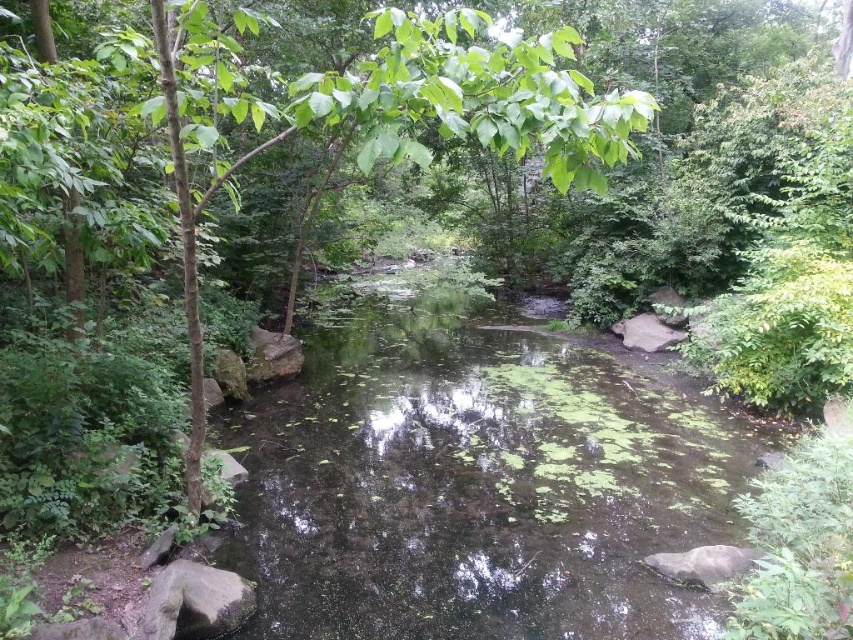
Which is in front, point (531, 380) or point (410, 116)?

Positioned in front is point (410, 116).

Who is positioned more to the right, green algae-covered water at center or green leafy tree at center?

green algae-covered water at center is more to the right.

Describe the element at coordinates (474, 484) in the screenshot. I see `green algae-covered water at center` at that location.

This screenshot has height=640, width=853. Find the location of `green algae-covered water at center`. green algae-covered water at center is located at coordinates (474, 484).